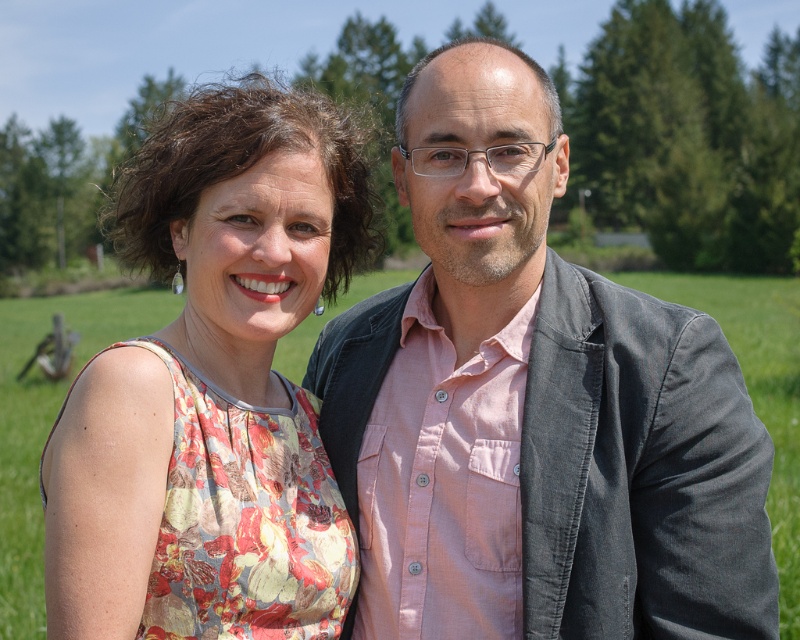
Which is above, floral fabric dress at left or floral fabric dress at center?

floral fabric dress at center

Which is more to the left, floral fabric dress at left or floral fabric dress at center?

floral fabric dress at left

Who is more distant from viewer, (300, 317) or (782, 572)?

The point (782, 572) is more distant.

Identify the location of floral fabric dress at left. (214, 385).

Is matte gray blazer at center to the right of floral fabric dress at center from the viewer's perspective?

Incorrect, matte gray blazer at center is not on the right side of floral fabric dress at center.

Which is in front, point (430, 493) or point (57, 384)?

Point (430, 493) is in front.

Between point (516, 604) and point (790, 348), which one is positioned behind?

Point (790, 348)

Find the location of a particular element. This screenshot has width=800, height=640. matte gray blazer at center is located at coordinates (533, 408).

Is matte gray blazer at center to the left of floral fabric dress at left from the viewer's perspective?

In fact, matte gray blazer at center is to the right of floral fabric dress at left.

Which of these two, matte gray blazer at center or floral fabric dress at left, stands taller?

floral fabric dress at left

Between point (605, 365) and point (322, 624), which one is positioned in front?

Point (605, 365) is more forward.

Locate an element on the screen. The image size is (800, 640). matte gray blazer at center is located at coordinates (533, 408).